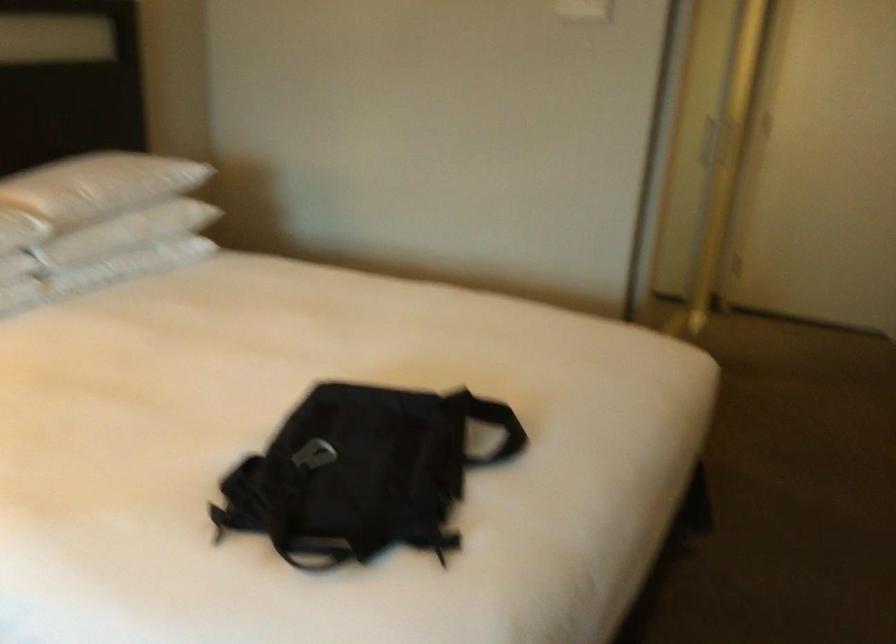
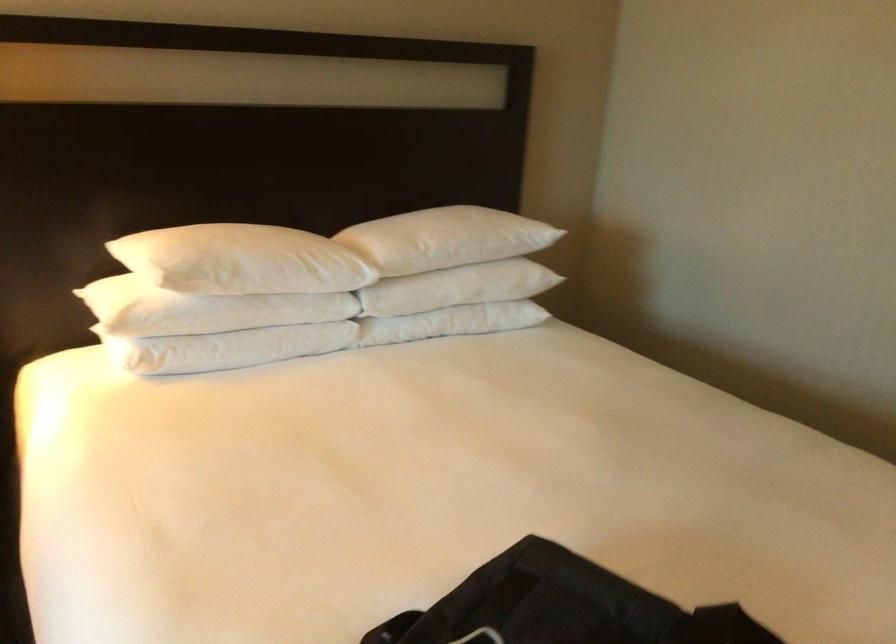
In the second image, find the point that corresponds to (x=135, y=263) in the first image.

(451, 322)